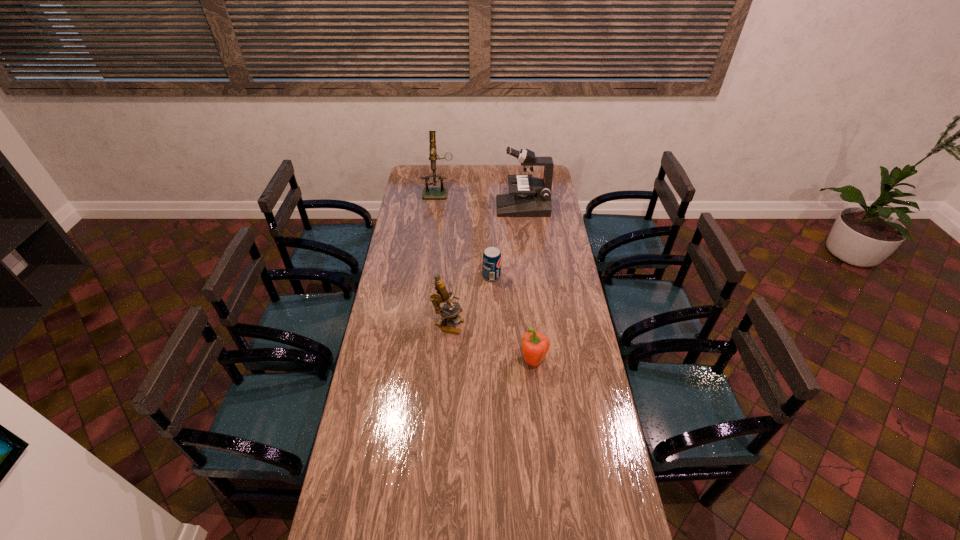
At what (x,y) coordinates should I click in order to perform the action: click on free space at the far left corner. Please return your answer as a coordinate pair (x, y). The image size is (960, 540). Looking at the image, I should click on (412, 168).

Where is `free space between the shortest object and the second nearest object`? This screenshot has width=960, height=540. free space between the shortest object and the second nearest object is located at coordinates (469, 300).

Where is `vacant point located between the rightmost microscope and the pepper`? vacant point located between the rightmost microscope and the pepper is located at coordinates (528, 285).

Locate an element on the screen. The width and height of the screenshot is (960, 540). free point between the third farthest object and the nearest object is located at coordinates (513, 319).

The width and height of the screenshot is (960, 540). In order to click on free space between the pop and the shortest microscope in this screenshot , I will do `click(469, 300)`.

Locate which object ranks in proximity to the third tallest object. Please provide its 2D coordinates. Your answer should be formatted as a tuple, i.e. [(x, y)], where the tuple contains the x and y coordinates of a point satisfying the conditions above.

[(491, 257)]

Find the location of a particular element. object that can be found as the closest to the third farthest object is located at coordinates (442, 296).

At what (x,y) coordinates should I click in order to perform the action: click on microscope that is the third closest to the shortest object. Please return your answer as a coordinate pair (x, y). This screenshot has height=540, width=960. Looking at the image, I should click on (441, 192).

Identify which microscope is the second nearest to the nearest object. Please provide its 2D coordinates. Your answer should be formatted as a tuple, i.e. [(x, y)], where the tuple contains the x and y coordinates of a point satisfying the conditions above.

[(532, 196)]